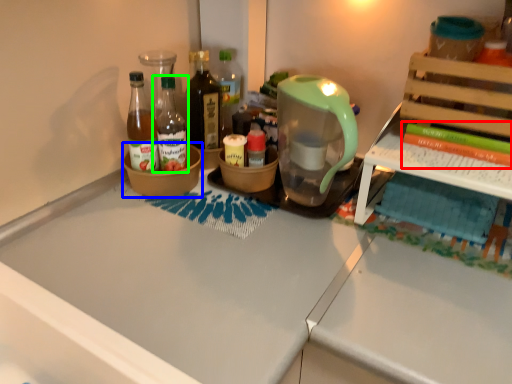
Question: Considering the real-world distances, which object is closest to book (highlighted by a red box)? bowl (highlighted by a blue box) or bottle (highlighted by a green box).

Choices:
 (A) bowl
 (B) bottle

Answer: (A)